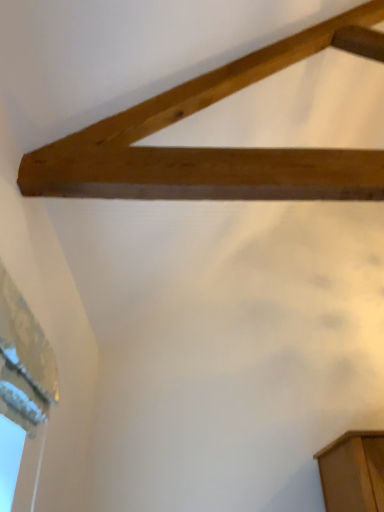
Describe the element at coordinates (214, 148) in the screenshot. I see `natural wood plank at upper center` at that location.

At what (x,y) coordinates should I click in order to perform the action: click on natural wood plank at upper center. Please return your answer as a coordinate pair (x, y). Image resolution: width=384 pixels, height=512 pixels. Looking at the image, I should click on (214, 148).

At what (x,y) coordinates should I click in order to perform the action: click on white textured paper at upper left. Please return your answer as a coordinate pair (x, y). Image resolution: width=384 pixels, height=512 pixels. Looking at the image, I should click on (24, 362).

The height and width of the screenshot is (512, 384). What do you see at coordinates (24, 362) in the screenshot? I see `white textured paper at upper left` at bounding box center [24, 362].

Measure the distance between point (x=32, y=426) and camera.

Point (x=32, y=426) and camera are 4.79 feet apart.

What are the coordinates of `natural wood plank at upper center` in the screenshot? It's located at (214, 148).

Which is more to the left, white textured paper at upper left or natural wood plank at upper center?

white textured paper at upper left is more to the left.

From the picture: Who is more distant, white textured paper at upper left or natural wood plank at upper center?

natural wood plank at upper center is more distant.

Is point (8, 358) more distant than point (269, 52)?

No, it is in front of (269, 52).

From the image's perspective, who appears lower, white textured paper at upper left or natural wood plank at upper center?

white textured paper at upper left is shown below in the image.

From a real-world perspective, which object stands above the other?

natural wood plank at upper center.

Which object is wider, white textured paper at upper left or natural wood plank at upper center?

With larger width is natural wood plank at upper center.

Considering the relative sizes of white textured paper at upper left and natural wood plank at upper center in the image provided, is white textured paper at upper left shorter than natural wood plank at upper center?

Answer: Correct, white textured paper at upper left is not as tall as natural wood plank at upper center.

Based on their sizes in the image, would you say white textured paper at upper left is bigger or smaller than natural wood plank at upper center?

In the image, white textured paper at upper left appears to be smaller than natural wood plank at upper center.

Is white textured paper at upper left inside or outside of natural wood plank at upper center?

white textured paper at upper left cannot be found inside natural wood plank at upper center.

Is white textured paper at upper left far from natural wood plank at upper center?

white textured paper at upper left is actually quite close to natural wood plank at upper center.

Consider the image. Could you tell me if white textured paper at upper left is facing natural wood plank at upper center?

No, white textured paper at upper left is not turned towards natural wood plank at upper center.

Measure the distance between white textured paper at upper left and natural wood plank at upper center.

The distance of white textured paper at upper left from natural wood plank at upper center is 29.84 inches.

Where is `plank above the white textured paper at upper left (from a real-world perspective)`? The height and width of the screenshot is (512, 384). plank above the white textured paper at upper left (from a real-world perspective) is located at coordinates (214, 148).

Is natural wood plank at upper center at the right side of white textured paper at upper left?

Indeed, natural wood plank at upper center is positioned on the right side of white textured paper at upper left.

Does natural wood plank at upper center lie behind white textured paper at upper left?

Yes, it is.

Considering the points (114, 155) and (14, 408), which point is behind, point (114, 155) or point (14, 408)?

The point (114, 155) is behind.

From the image's perspective, is natural wood plank at upper center above or below white textured paper at upper left?

natural wood plank at upper center is above white textured paper at upper left.

Consider the image. From a real-world perspective, which is physically below, natural wood plank at upper center or white textured paper at upper left?

From a 3D spatial view, white textured paper at upper left is below.

In the scene shown: Considering the relative sizes of natural wood plank at upper center and white textured paper at upper left in the image provided, is natural wood plank at upper center thinner than white textured paper at upper left?

In fact, natural wood plank at upper center might be wider than white textured paper at upper left.

Which of these two, natural wood plank at upper center or white textured paper at upper left, stands taller?

With more height is natural wood plank at upper center.

Based on the photo, looking at the image, does natural wood plank at upper center seem bigger or smaller compared to white textured paper at upper left?

Clearly, natural wood plank at upper center is larger in size than white textured paper at upper left.

Is natural wood plank at upper center positioned beyond the bounds of white textured paper at upper left?

That's correct, natural wood plank at upper center is outside of white textured paper at upper left.

Is natural wood plank at upper center positioned far away from white textured paper at upper left?

No, there isn't a large distance between natural wood plank at upper center and white textured paper at upper left.

Is natural wood plank at upper center turned away from white textured paper at upper left?

No, natural wood plank at upper center's orientation is not away from white textured paper at upper left.

How different are the orientations of natural wood plank at upper center and white textured paper at upper left in degrees?

The facing directions of natural wood plank at upper center and white textured paper at upper left are 0.00305 degrees apart.

In the image, there is a natural wood plank at upper center. At what (x,y) coordinates should I click in order to perform the action: click on window below it (from a real-world perspective). Please return your answer as a coordinate pair (x, y). The width and height of the screenshot is (384, 512). Looking at the image, I should click on (24, 362).

Image resolution: width=384 pixels, height=512 pixels. Find the location of `window below the natural wood plank at upper center (from a real-world perspective)`. window below the natural wood plank at upper center (from a real-world perspective) is located at coordinates (24, 362).

Where is `window in front of the natural wood plank at upper center`? window in front of the natural wood plank at upper center is located at coordinates (24, 362).